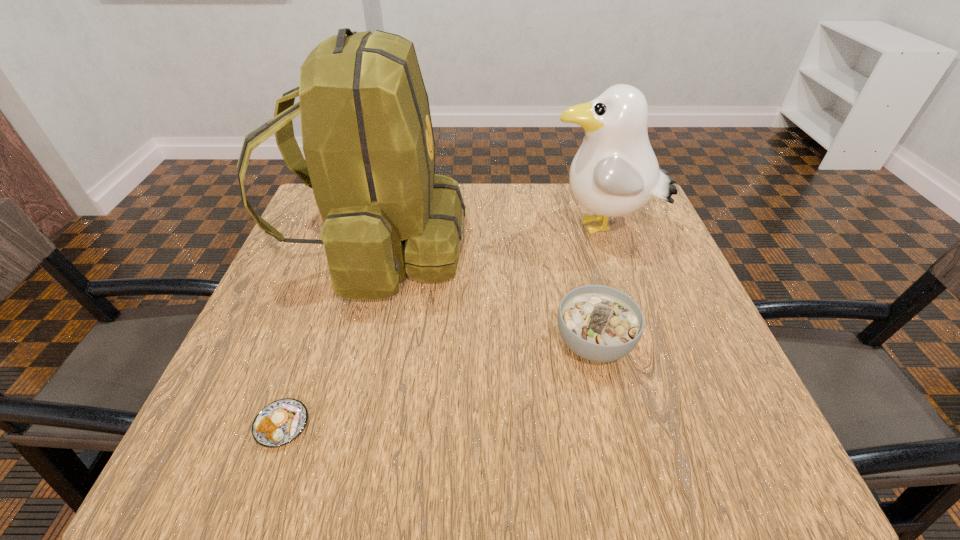
Locate an element on the screen. vacant space located 0.190m on the left of the third farthest object is located at coordinates (454, 343).

You are a GUI agent. You are given a task and a screenshot of the screen. Output one action in this format:
    pyautogui.click(x=<x>, y=<y>)
    Task: Click on the vacant point located on the back of the shortest object
    
    Given the screenshot: What is the action you would take?
    pyautogui.click(x=324, y=303)

At what (x,y) coordinates should I click in order to perform the action: click on backpack located in the far edge section of the desktop. Please return your answer as a coordinate pair (x, y). Looking at the image, I should click on (367, 136).

Where is `gull at the far edge`? This screenshot has width=960, height=540. gull at the far edge is located at coordinates (615, 172).

This screenshot has width=960, height=540. I want to click on object present at the near edge, so click(280, 422).

You are a GUI agent. You are given a task and a screenshot of the screen. Output one action in this format:
    pyautogui.click(x=<x>, y=<y>)
    Task: Click on the backpack that is at the left edge
    The height and width of the screenshot is (540, 960).
    Given the screenshot: What is the action you would take?
    pyautogui.click(x=367, y=136)

Where is `pastry that is at the left edge`? pastry that is at the left edge is located at coordinates (280, 422).

The width and height of the screenshot is (960, 540). I want to click on gull at the right edge, so click(615, 172).

The height and width of the screenshot is (540, 960). I want to click on soup bowl at the right edge, so click(599, 323).

What are the coordinates of `object present at the far left corner` in the screenshot? It's located at tap(367, 136).